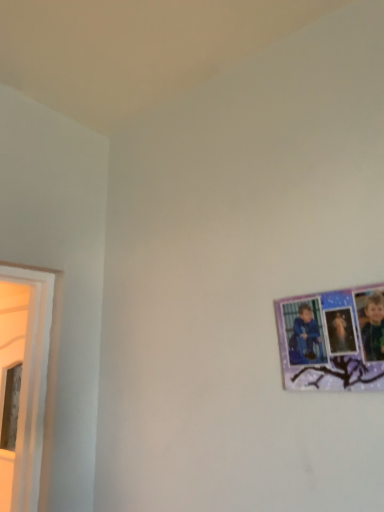
The height and width of the screenshot is (512, 384). I want to click on purple paper picture frame at upper right, so click(332, 340).

What do you see at coordinates (332, 340) in the screenshot? The width and height of the screenshot is (384, 512). I see `purple paper picture frame at upper right` at bounding box center [332, 340].

Identify the location of purple paper picture frame at upper right. The image size is (384, 512). (332, 340).